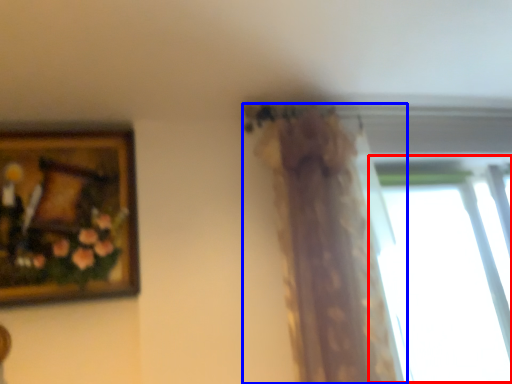
Question: Which object is further to the camera taking this photo, window (highlighted by a red box) or curtain (highlighted by a blue box)?

Choices:
 (A) window
 (B) curtain

Answer: (A)